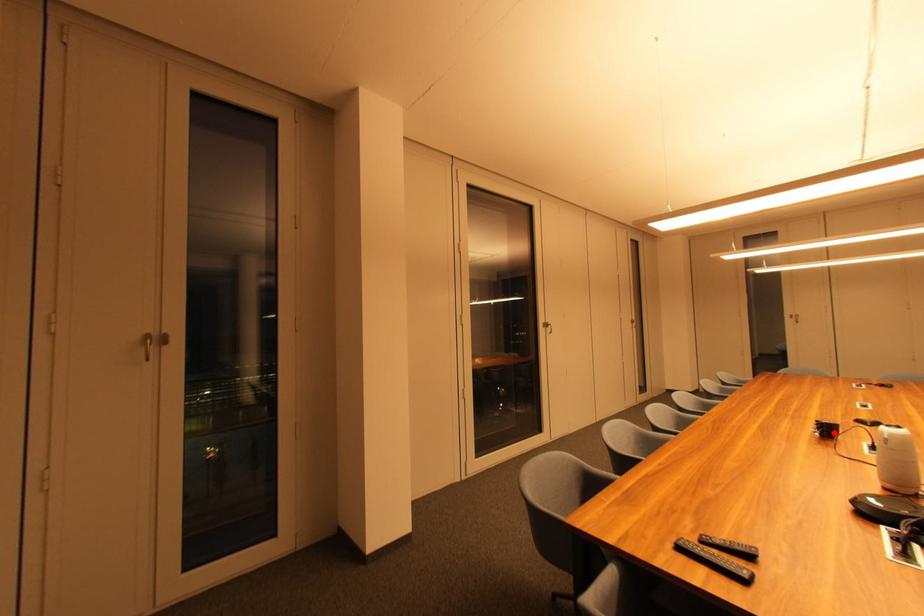
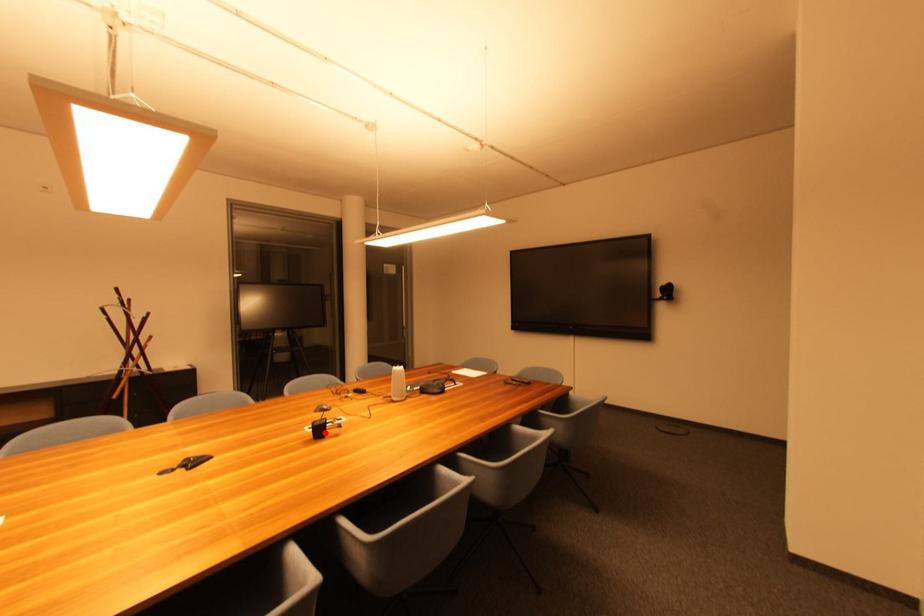
I am providing you with two images of the same scene from different viewpoints. A red point is marked on the first image and another point is marked on the second image. Do the highlighted points in image1 and image2 indicate the same real-world spot?

Yes